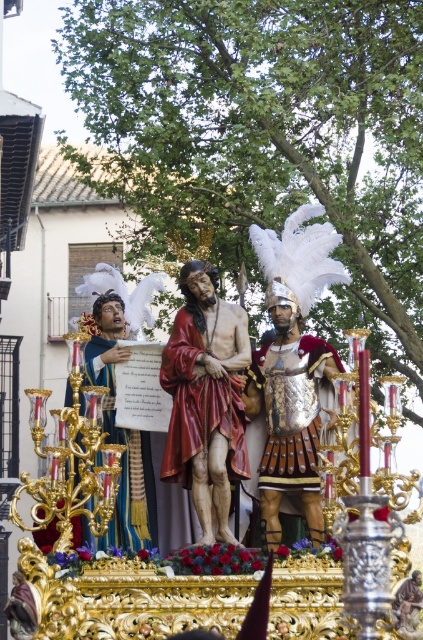
Question: Is the position of polished gold statue at center less distant than that of smooth red robe at center?

Choices:
 (A) no
 (B) yes

Answer: (B)

Question: Is polished gold statue at center closer to the viewer compared to shiny silver armor at center?

Choices:
 (A) no
 (B) yes

Answer: (B)

Question: Among these objects, which one is nearest to the camera?

Choices:
 (A) blue velvet robe at center
 (B) smooth red robe at center
 (C) shiny silver armor at center

Answer: (B)

Question: Which point is closer to the camera?

Choices:
 (A) (282, 400)
 (B) (134, 509)
 (C) (283, 438)

Answer: (C)

Question: Does gold metallic armor at center appear under blue velvet robe at center?

Choices:
 (A) yes
 (B) no

Answer: (B)

Question: Which of these objects is positioned closest to the blue velvet robe at center?

Choices:
 (A) shiny silver armor at center
 (B) smooth red robe at center
 (C) gold metallic armor at center
 (D) polished gold statue at center

Answer: (B)